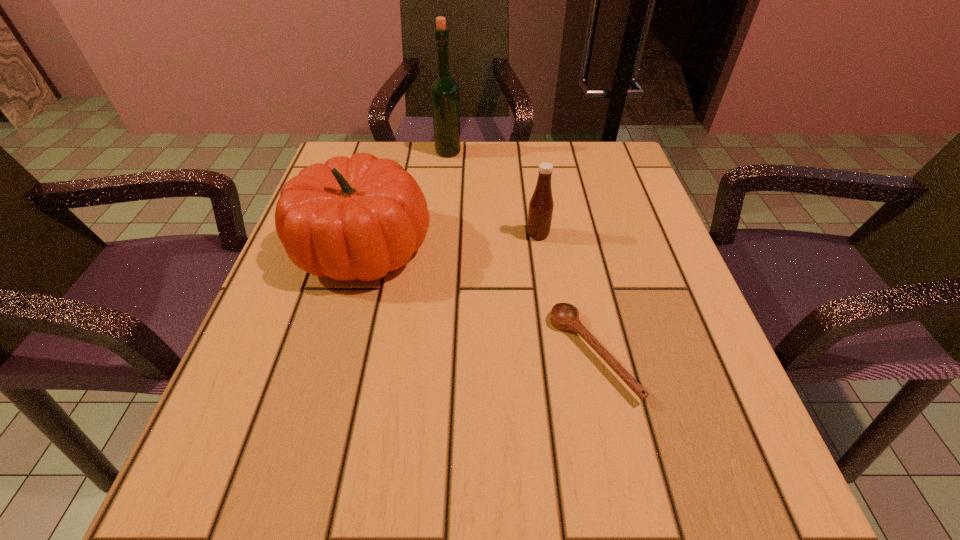
Find the location of `object located in the far edge section of the desktop`. object located in the far edge section of the desktop is located at coordinates (444, 90).

Identify the location of object positioned at the left edge. Image resolution: width=960 pixels, height=540 pixels. (353, 218).

Where is `object located at the right edge`? This screenshot has width=960, height=540. object located at the right edge is located at coordinates (564, 316).

The height and width of the screenshot is (540, 960). I want to click on vacant space at the far edge, so click(460, 194).

This screenshot has width=960, height=540. I want to click on vacant space at the near edge of the desktop, so click(x=328, y=461).

In the image, there is a desktop. Where is `free space at the left edge`? The width and height of the screenshot is (960, 540). free space at the left edge is located at coordinates (280, 431).

Where is `free space at the right edge`? This screenshot has width=960, height=540. free space at the right edge is located at coordinates (700, 318).

Locate an element on the screen. This screenshot has height=540, width=960. free space at the far left corner is located at coordinates (369, 151).

Where is `free space at the near left corner`? The height and width of the screenshot is (540, 960). free space at the near left corner is located at coordinates (256, 469).

Image resolution: width=960 pixels, height=540 pixels. In order to click on vacant space at the far right corner of the desktop in this screenshot , I will do `click(567, 146)`.